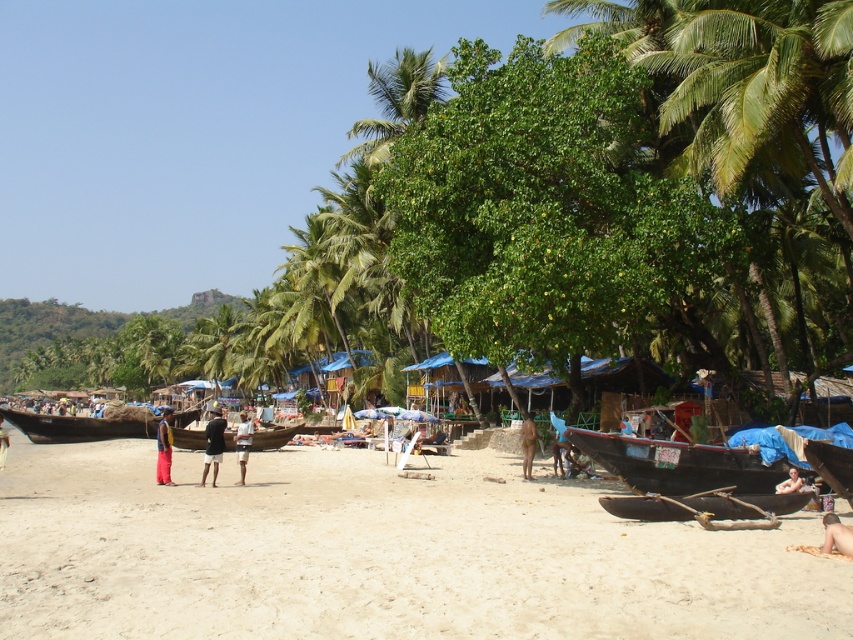
You are a lifeguard standing at the center of the beach. You need to reach either the tan skin human at lower right or the light brown skin at lower right quickly. Which one can you reach faster if you start from the center?

You can reach the tan skin human at lower right and the light brown skin at lower right in the same time since the distance between them is 4.06 meters, so both are equidistant from the center.